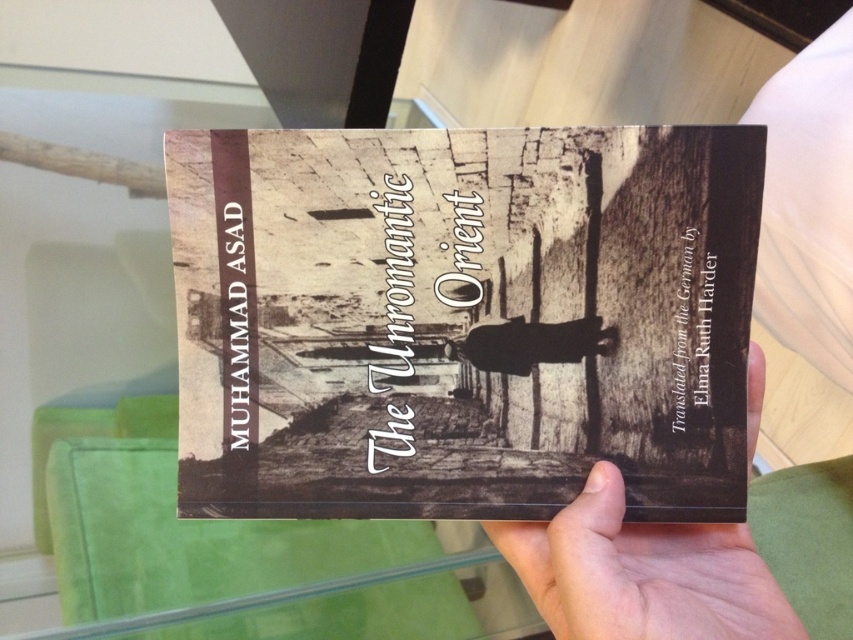
Is sepia-toned paper book at center wider than smooth skin hand at center?

Indeed, sepia-toned paper book at center has a greater width compared to smooth skin hand at center.

Does sepia-toned paper book at center appear on the left side of smooth skin hand at center?

Indeed, sepia-toned paper book at center is positioned on the left side of smooth skin hand at center.

Is point (532, 129) closer to camera compared to point (666, 625)?

No, it is behind (666, 625).

Where is `sepia-toned paper book at center`? Image resolution: width=853 pixels, height=640 pixels. sepia-toned paper book at center is located at coordinates (463, 320).